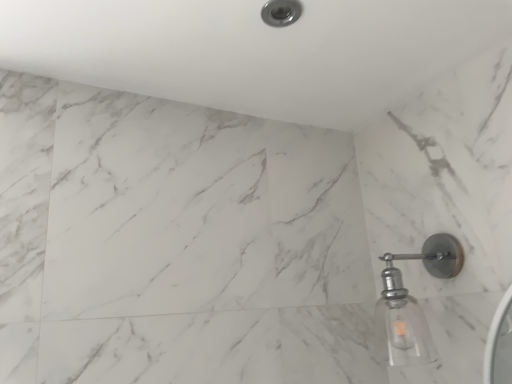
Describe the element at coordinates (414, 300) in the screenshot. I see `polished chrome sconce at right` at that location.

What is the approximate width of polished chrome sconce at right?

26.43 centimeters.

Where is `polished chrome sconce at right`? The height and width of the screenshot is (384, 512). polished chrome sconce at right is located at coordinates (414, 300).

At what (x,y) coordinates should I click in order to perform the action: click on polished chrome sconce at right. Please return your answer as a coordinate pair (x, y). The width and height of the screenshot is (512, 384). Looking at the image, I should click on coord(414,300).